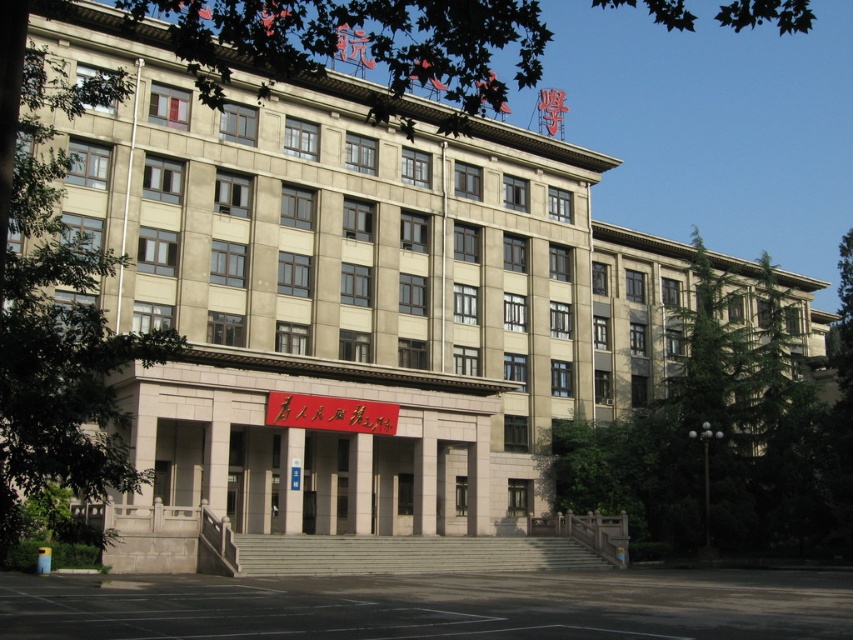
Question: Does green leafy tree at right come behind green leafy tree at left?

Choices:
 (A) no
 (B) yes

Answer: (B)

Question: Which of the following is the farthest from the observer?

Choices:
 (A) green leafy tree at upper center
 (B) green leafy tree at left
 (C) green leafy tree at right

Answer: (C)

Question: Does green leafy tree at right appear on the right side of green leafy tree at left?

Choices:
 (A) no
 (B) yes

Answer: (B)

Question: Which of these objects is positioned farthest from the green leafy tree at left?

Choices:
 (A) green leafy tree at right
 (B) green leafy tree at upper center

Answer: (A)

Question: Is green leafy tree at right smaller than green leafy tree at upper center?

Choices:
 (A) yes
 (B) no

Answer: (A)

Question: Which of the following is the closest to the observer?

Choices:
 (A) (68, 477)
 (B) (256, 26)

Answer: (B)